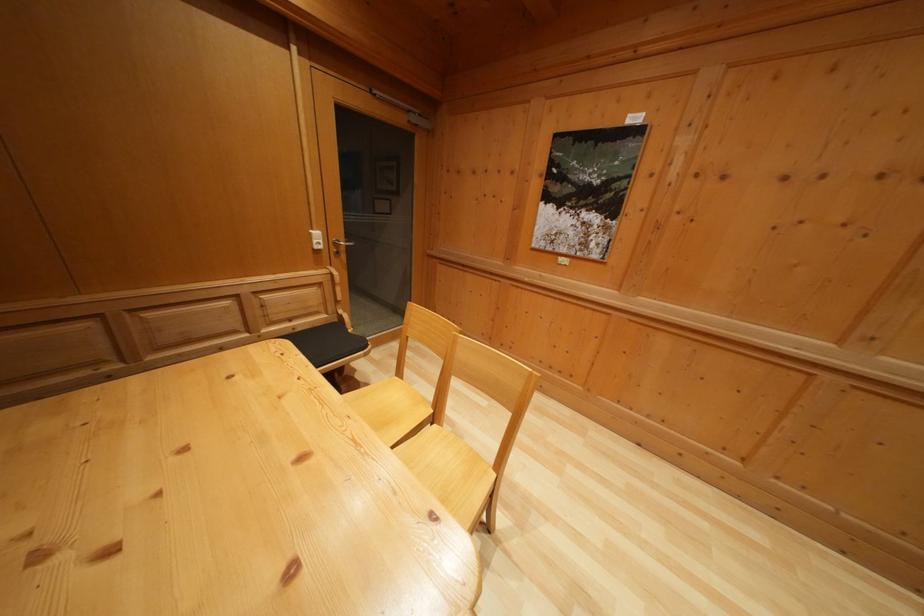
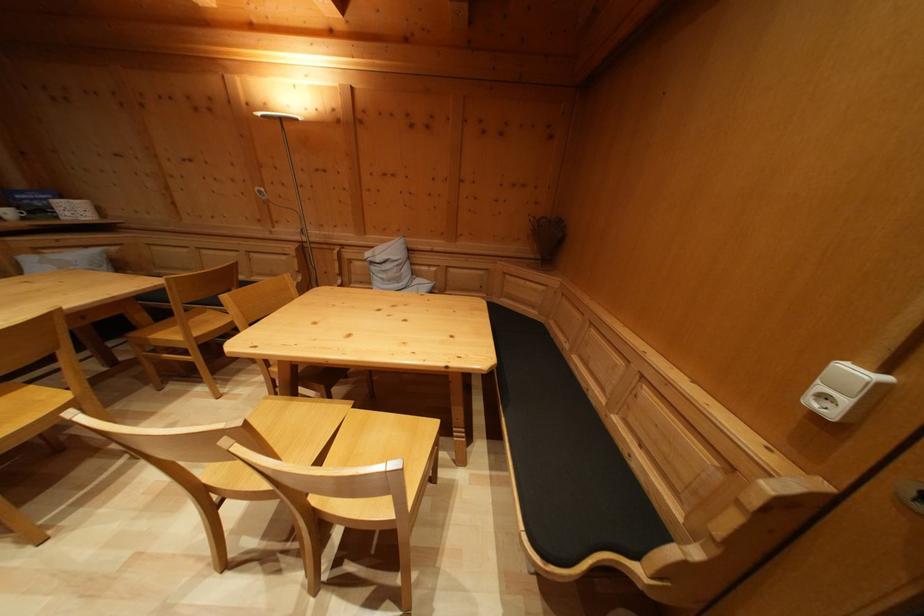
Find the pixel in the second image that matches (322,240) in the first image.

(859, 379)